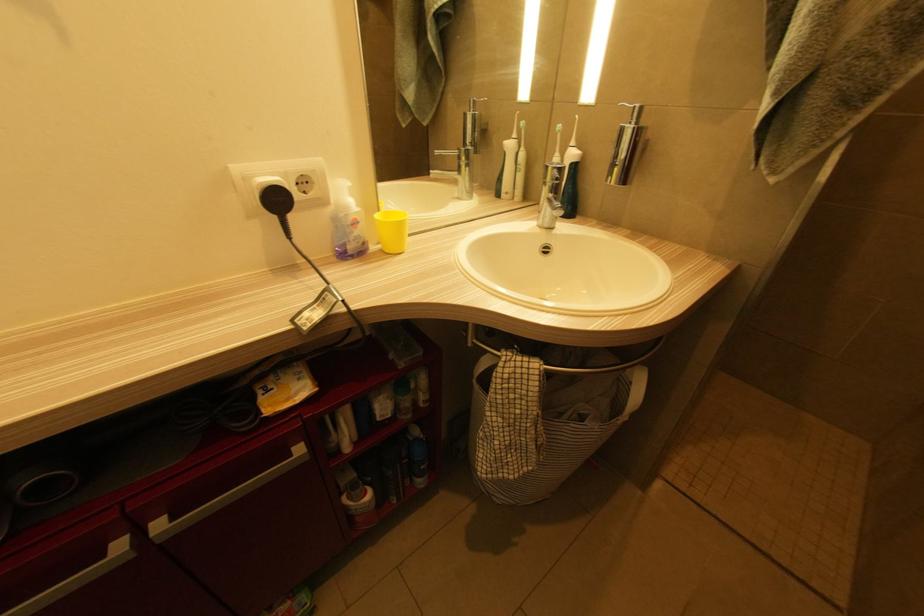
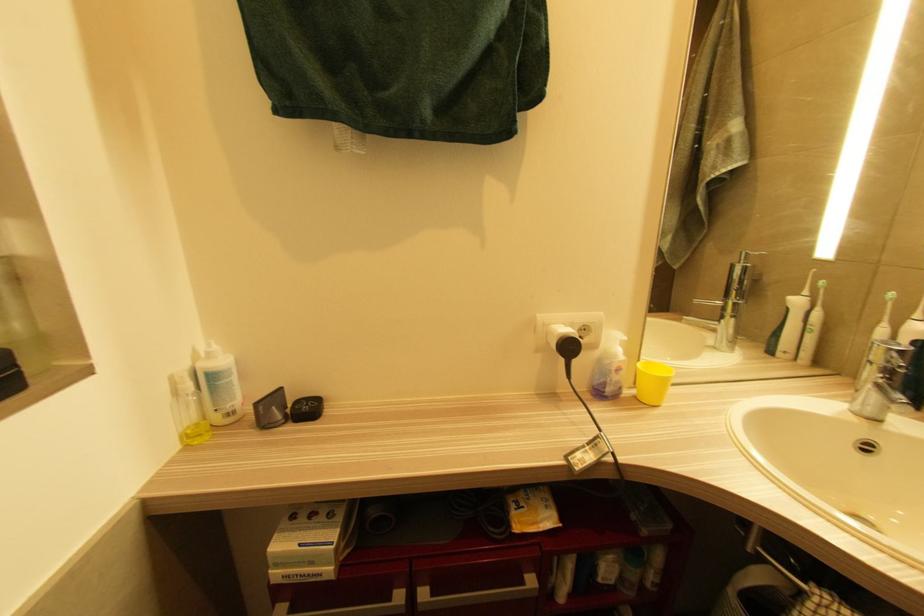
Question: The camera is either moving clockwise (left) or counter-clockwise (right) around the object. The first image is from the beginning of the video and the second image is from the end. Is the camera moving left or right when shooting the video?

Choices:
 (A) Left
 (B) Right

Answer: (B)